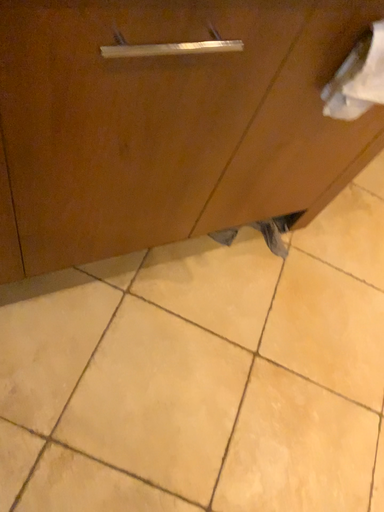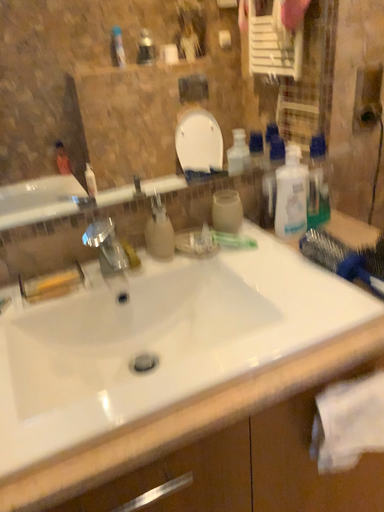
Question: Which way did the camera rotate in the video?

Choices:
 (A) rotated right
 (B) rotated left

Answer: (B)